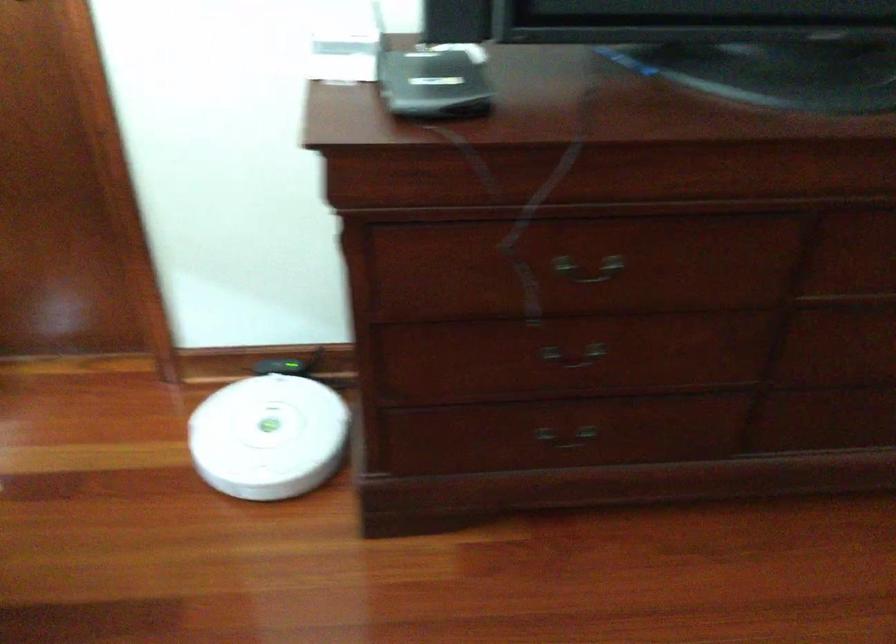
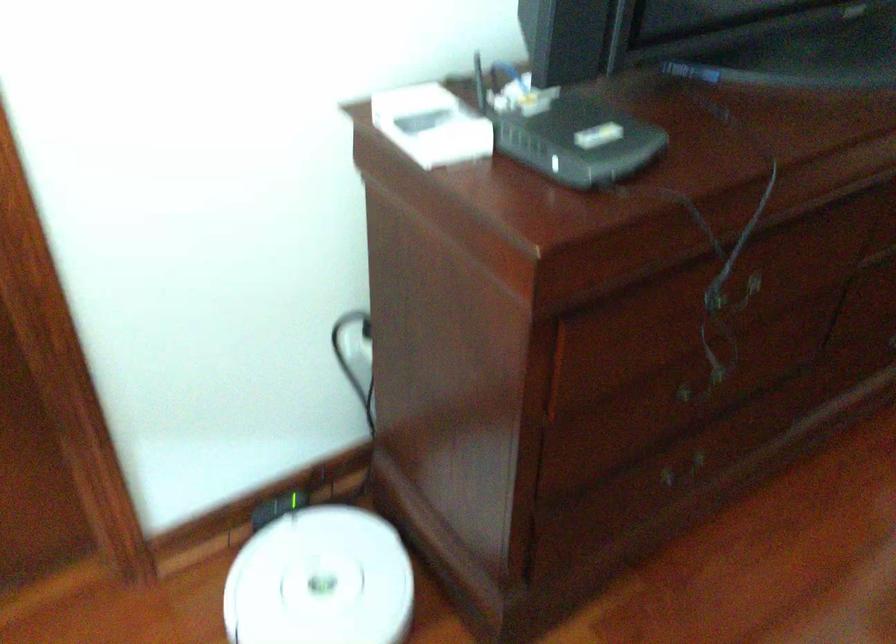
Question: The images are taken continuously from a first-person perspective. In which direction is your viewpoint rotating?

Choices:
 (A) Left
 (B) Right
 (C) Up
 (D) Down

Answer: (B)